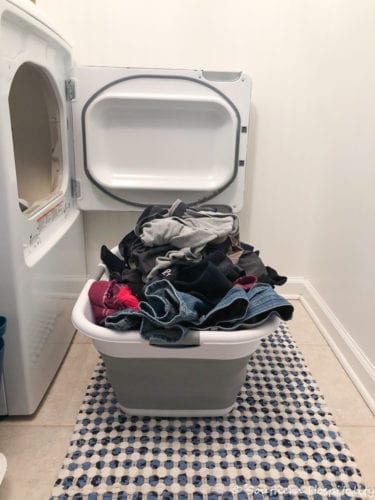
At what (x,y) coordinates should I click in order to perform the action: click on dryer opening. Please return your answer as a coordinate pair (x, y). This screenshot has height=500, width=375. Looking at the image, I should click on (30, 117).